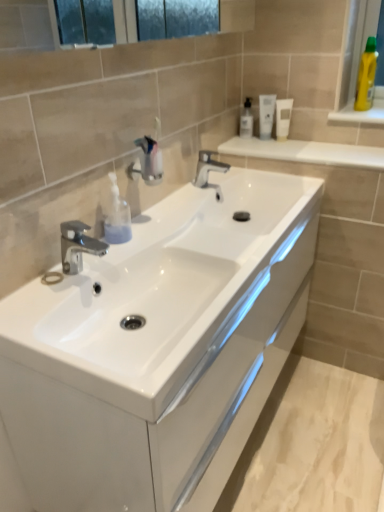
In order to click on vacant point above white glossy shelf at upper right (from a real-world perspective) in this screenshot , I will do click(296, 143).